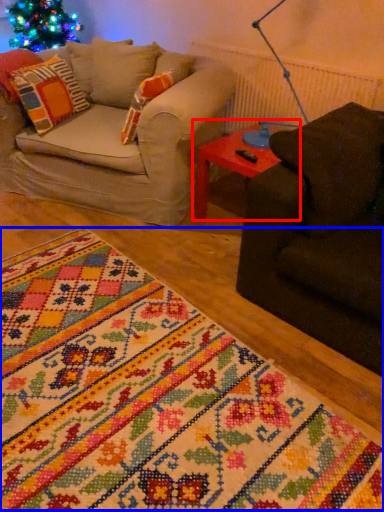
Question: Which object appears closest to the camera in this image, table (highlighted by a red box) or blanket (highlighted by a blue box)?

Choices:
 (A) table
 (B) blanket

Answer: (B)